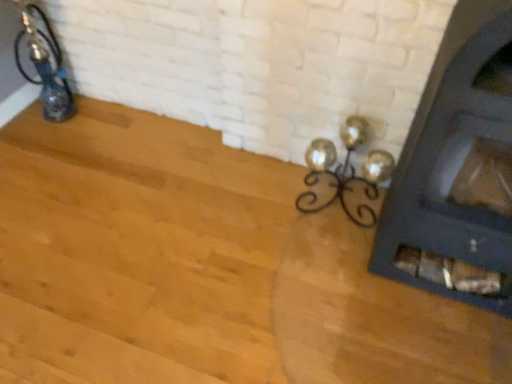
Question: Should I look upward or downward to see metallic gold lamp at center?

Choices:
 (A) down
 (B) up

Answer: (B)